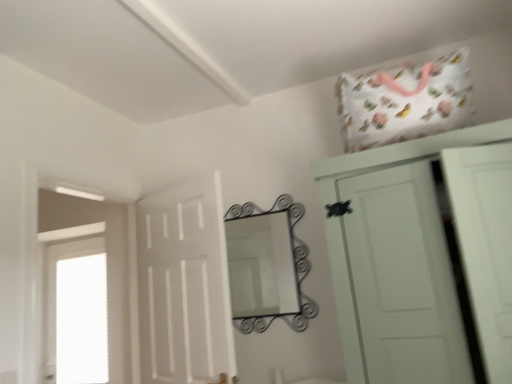
Question: Can you confirm if white matte door at center is shorter than metallic wrought iron mirror at center?

Choices:
 (A) no
 (B) yes

Answer: (A)

Question: Is white matte door at center beside metallic wrought iron mirror at center?

Choices:
 (A) yes
 (B) no

Answer: (B)

Question: Does white matte door at center turn towards metallic wrought iron mirror at center?

Choices:
 (A) yes
 (B) no

Answer: (B)

Question: Does white matte door at center come behind metallic wrought iron mirror at center?

Choices:
 (A) yes
 (B) no

Answer: (B)

Question: Is white matte door at center taller than metallic wrought iron mirror at center?

Choices:
 (A) yes
 (B) no

Answer: (A)

Question: Is white matte door at center in front of metallic wrought iron mirror at center?

Choices:
 (A) no
 (B) yes

Answer: (B)

Question: Is transparent glass window at left surrounding white matte door at center?

Choices:
 (A) no
 (B) yes

Answer: (A)

Question: From a real-world perspective, is transparent glass window at left below white matte door at center?

Choices:
 (A) yes
 (B) no

Answer: (A)

Question: Is transparent glass window at left taller than white matte door at center?

Choices:
 (A) no
 (B) yes

Answer: (B)

Question: From the image's perspective, would you say transparent glass window at left is shown under white matte door at center?

Choices:
 (A) yes
 (B) no

Answer: (A)

Question: Is transparent glass window at left further to the viewer compared to white matte door at center?

Choices:
 (A) no
 (B) yes

Answer: (B)

Question: Is transparent glass window at left closer to the viewer compared to white matte door at center?

Choices:
 (A) yes
 (B) no

Answer: (B)

Question: Considering the relative sizes of white matte cupboard at upper right and transparent glass window at left in the image provided, is white matte cupboard at upper right wider than transparent glass window at left?

Choices:
 (A) yes
 (B) no

Answer: (A)